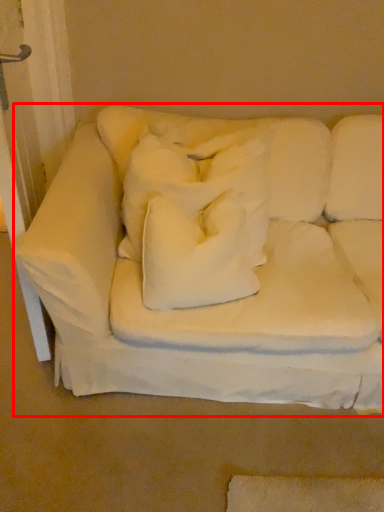
Question: Where is studio couch (annotated by the red box) located in relation to pillow in the image?

Choices:
 (A) right
 (B) left

Answer: (A)